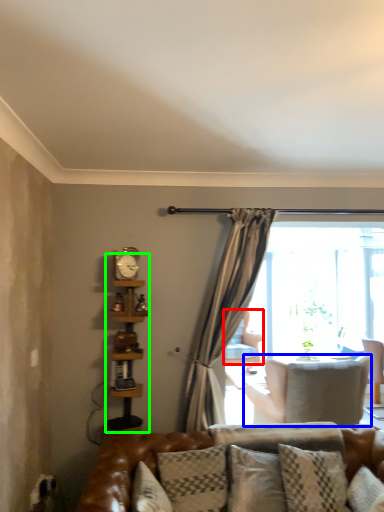
Question: Estimate the real-world distances between objects in this image. Which object is closer to chair (highlighted by a red box), chair (highlighted by a blue box) or bookshelf (highlighted by a green box)?

Choices:
 (A) chair
 (B) bookshelf

Answer: (A)